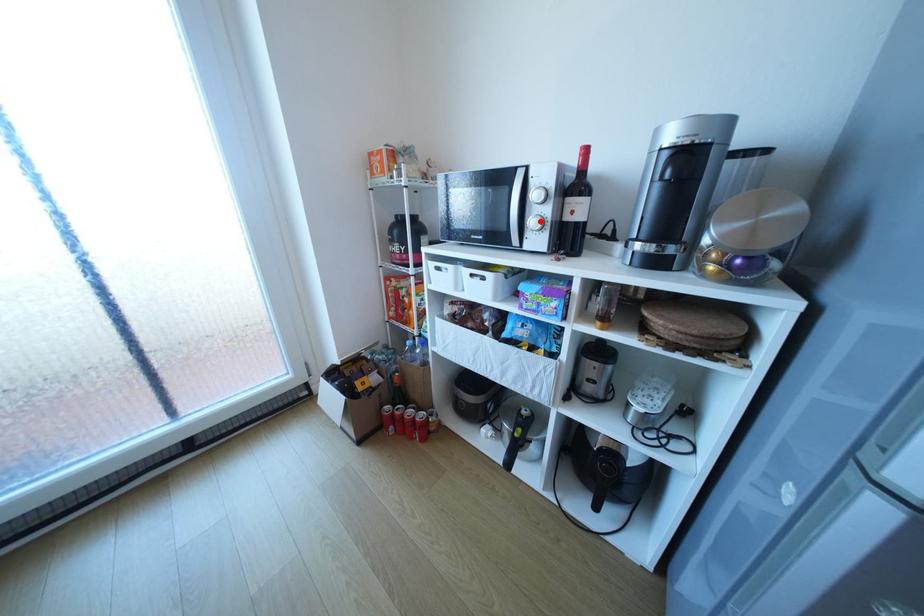
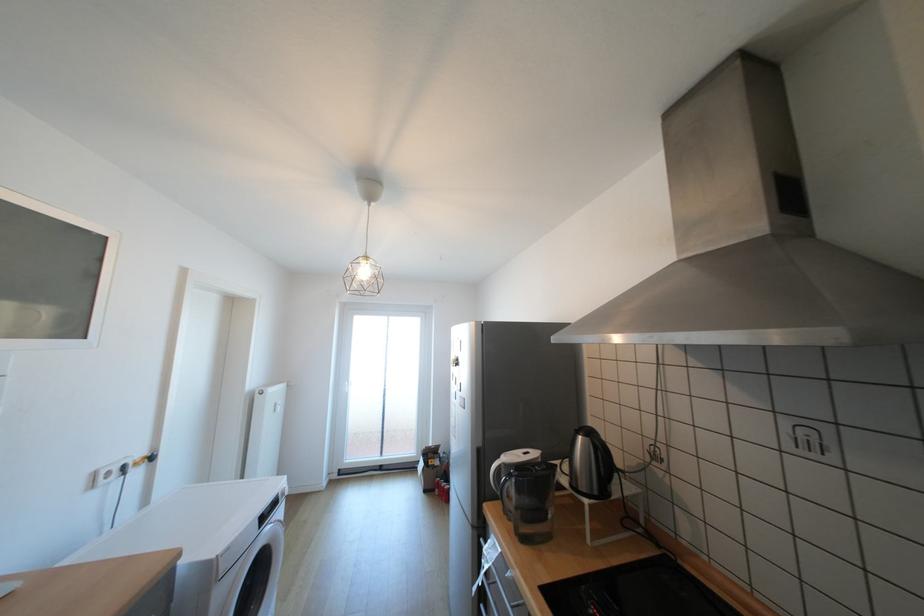
Question: I am providing you with two images of the same scene from different viewpoints. A red point is marked on the first image. At the location where the point appears in image 1, is it still visible in image 2?

Choices:
 (A) Yes
 (B) No

Answer: (B)